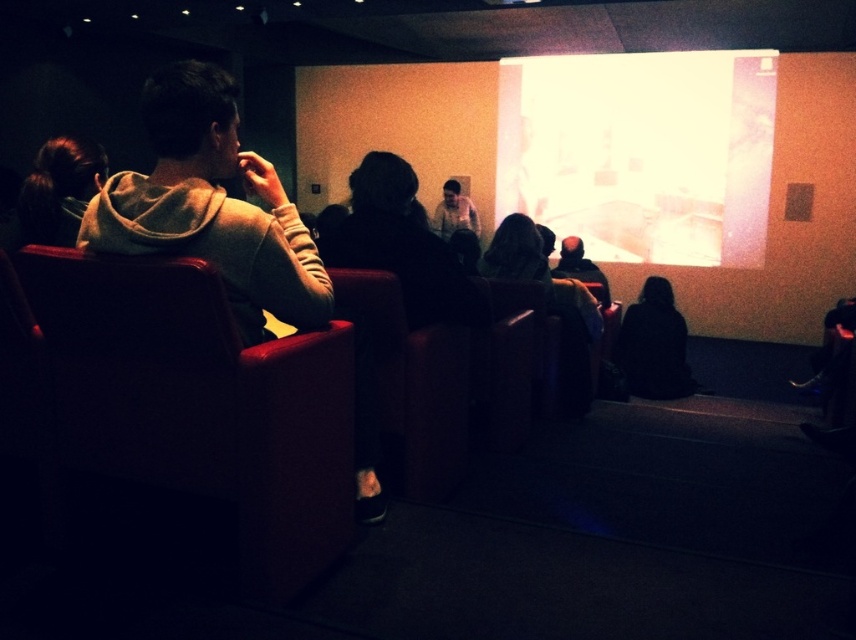
Question: Which point appears closest to the camera in this image?

Choices:
 (A) (623, 346)
 (B) (474, 227)

Answer: (A)

Question: Which point appears closest to the camera in this image?

Choices:
 (A) (233, 554)
 (B) (670, 236)
 (C) (446, 202)

Answer: (A)

Question: Does dark brown hair at left come behind black fabric at lower right?

Choices:
 (A) yes
 (B) no

Answer: (B)

Question: Does leather-like armchair at left have a smaller size compared to matte black hoodie at center?

Choices:
 (A) yes
 (B) no

Answer: (B)

Question: Does leather-like armchair at left come behind black fabric at lower right?

Choices:
 (A) no
 (B) yes

Answer: (A)

Question: Which object is positioned closest to the black fabric at lower right?

Choices:
 (A) bright white screen at upper center
 (B) matte black hoodie at center
 (C) leather-like armchair at left

Answer: (A)